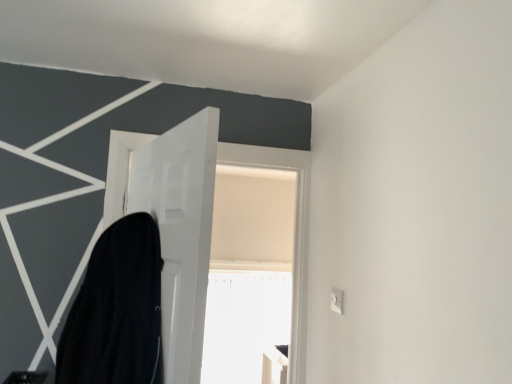
Question: In terms of size, does black matte robe at left appear bigger or smaller than white matte door at center?

Choices:
 (A) small
 (B) big

Answer: (A)

Question: Is black matte robe at left to the left or to the right of white matte door at center in the image?

Choices:
 (A) left
 (B) right

Answer: (A)

Question: Considering the positions of black matte robe at left and white matte door at center in the image, is black matte robe at left taller or shorter than white matte door at center?

Choices:
 (A) short
 (B) tall

Answer: (A)

Question: Relative to black matte robe at left, is white matte door at center in front or behind?

Choices:
 (A) behind
 (B) front

Answer: (A)

Question: Based on their positions, is white matte door at center located to the left or right of black matte robe at left?

Choices:
 (A) left
 (B) right

Answer: (B)

Question: From a real-world perspective, is white matte door at center above or below black matte robe at left?

Choices:
 (A) above
 (B) below

Answer: (A)

Question: Looking at the image, does white matte door at center seem bigger or smaller compared to black matte robe at left?

Choices:
 (A) small
 (B) big

Answer: (B)